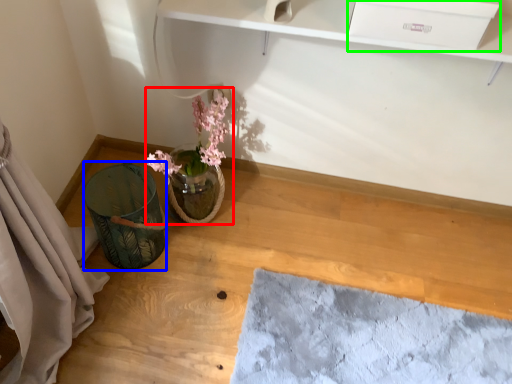
Question: Which is farther away from floral arrangement (highlighted by a red box)? vase (highlighted by a blue box) or drawer (highlighted by a green box)?

Choices:
 (A) vase
 (B) drawer

Answer: (B)